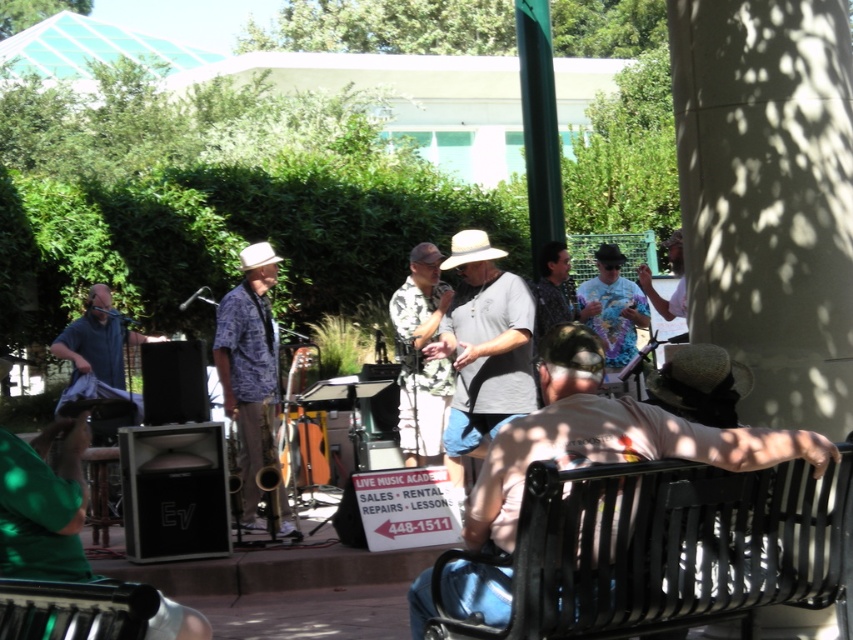
You are a spectator standing at the front row of the live music performance. You want to grab the brown leather hat at lower right but need to know if it is within your reach. Assuming your maximum reach is 2 meters, can you reach it?

The brown leather hat at lower right is 3.60 meters away from viewer, which is beyond your maximum reach of 2 meters. You cannot reach it.